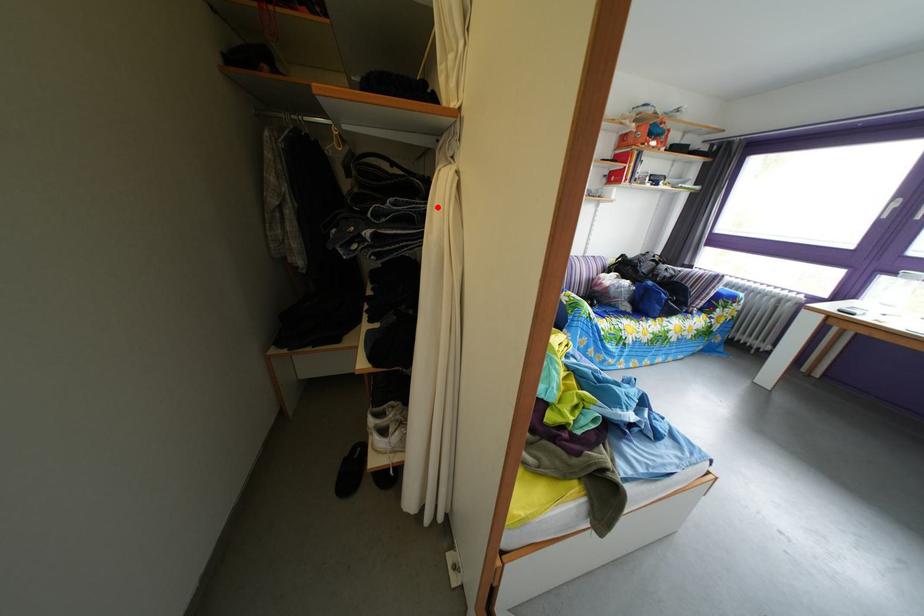
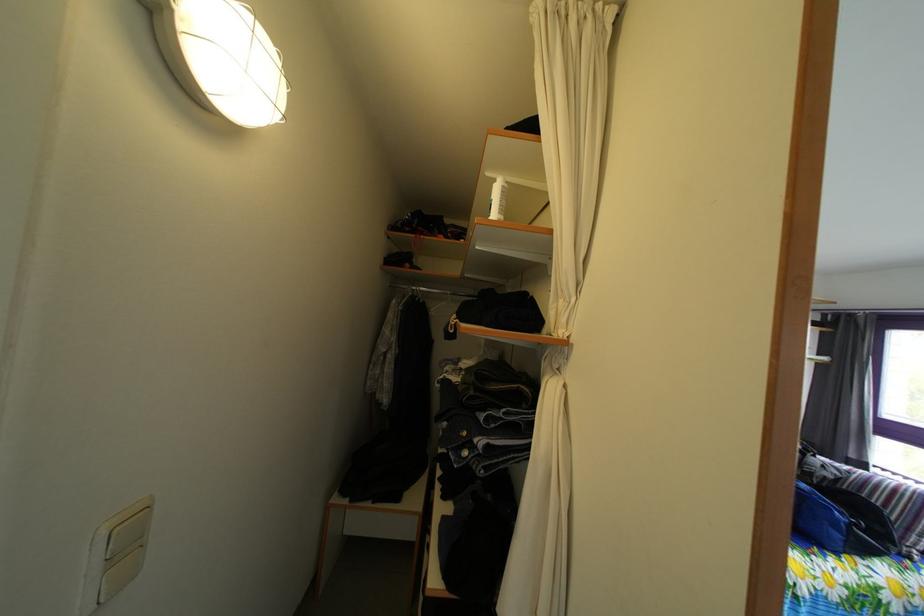
In the second image, find the point that corresponds to the highlighted location in the first image.

(545, 416)